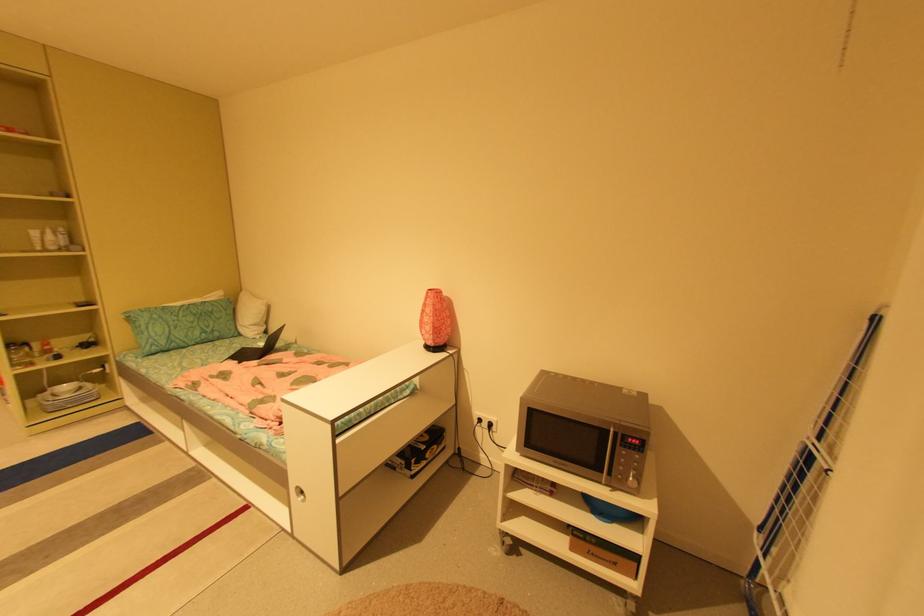
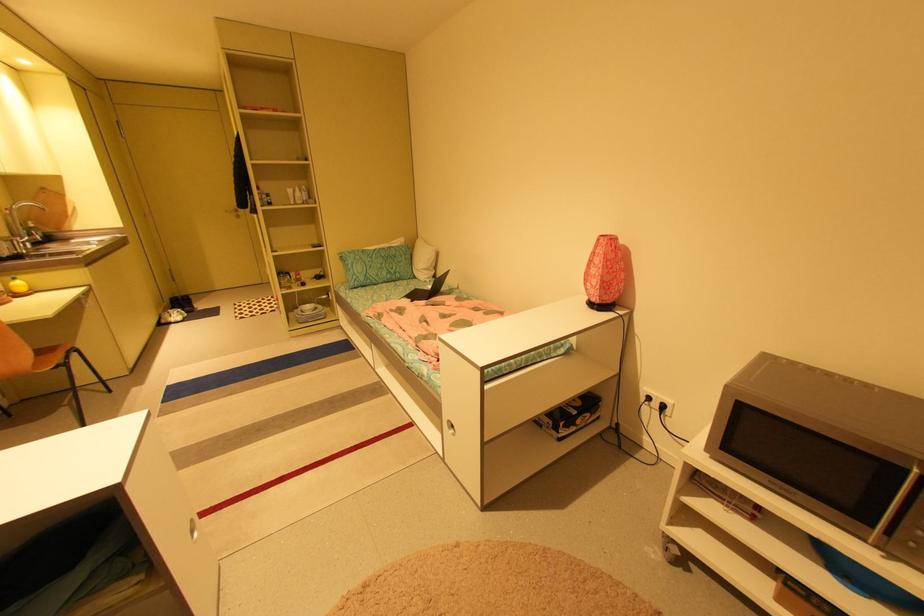
Find the pixel in the second image that matches [261,347] in the first image.

(431, 290)